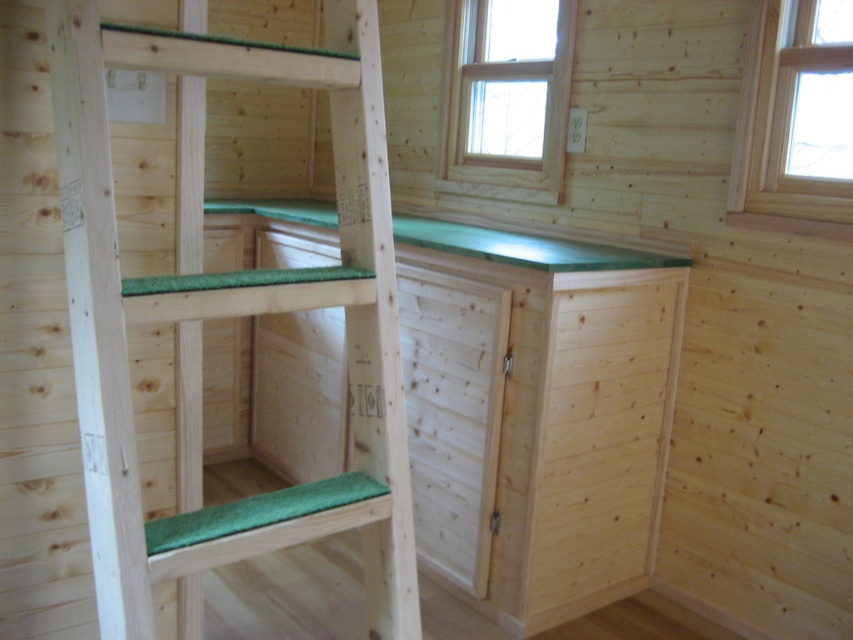
You are standing at the center of the wooden interior and want to climb up to the upper bunk bed. There is a green matte wood ladder at center. Is the ladder located at point (228, 316) the correct one to use?

Yes, the green matte wood ladder at center is located at point (228, 316), so it is the correct one to use to climb up to the upper bunk bed.

You are trying to reach the top bunk bed but the green matte wood ladder at center is shorter than the clear glass window at upper right. Which object is taller?

The clear glass window at upper right is taller than the green matte wood ladder at center.

You are standing in the wooden interior cabin and want to look outside through both windows. Which window, the clear glass window at upper center or the clear glass window at upper right, is closer to you?

The clear glass window at upper center is closer to you because the clear glass window at upper right is behind it.